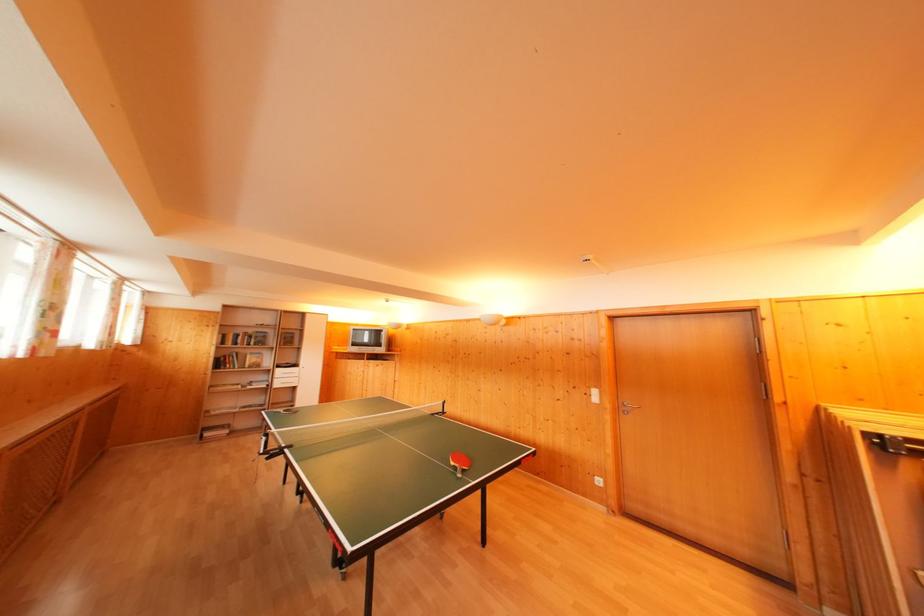
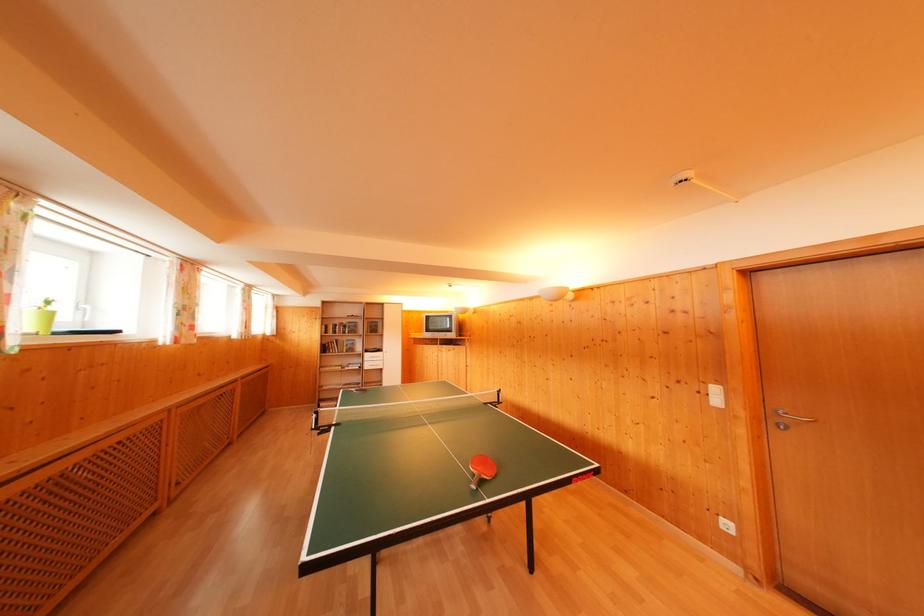
The point at (284, 376) is marked in the first image. Where is the corresponding point in the second image?

(371, 360)